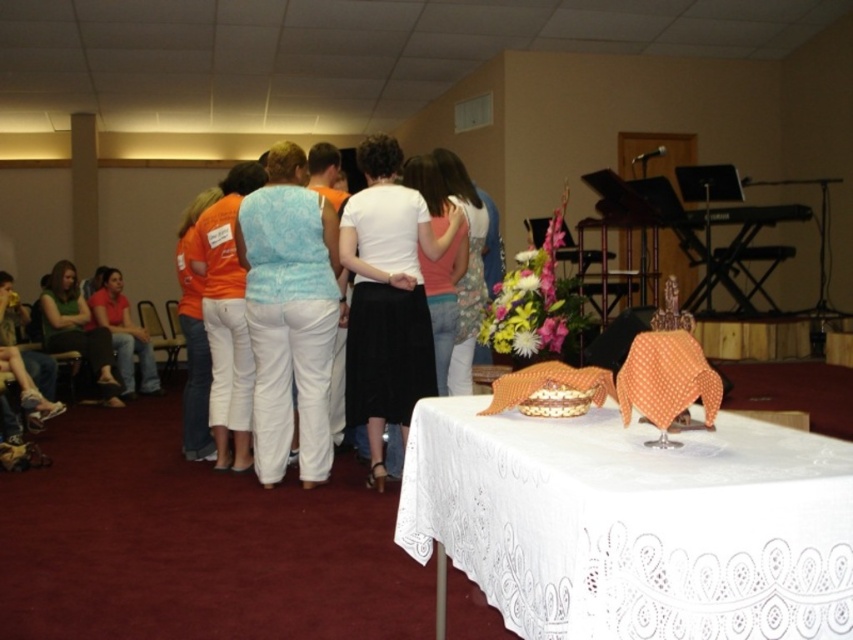
Who is positioned more to the left, orange cotton shirt at center or floral-patterned fabric at center?

Positioned to the left is orange cotton shirt at center.

Does orange cotton shirt at center lie behind floral-patterned fabric at center?

Yes, orange cotton shirt at center is further from the viewer.

Does point (181, 310) come closer to viewer compared to point (477, 282)?

That is False.

What are the coordinates of `orange cotton shirt at center` in the screenshot? It's located at (194, 337).

Who is lower down, white matte skirt at center or green fabric shirt at lower left?

green fabric shirt at lower left is lower down.

Can you confirm if white matte skirt at center is taller than green fabric shirt at lower left?

Yes, white matte skirt at center is taller than green fabric shirt at lower left.

Is point (439, 256) farther from viewer compared to point (70, 305)?

No, it is not.

The image size is (853, 640). In order to click on white matte skirt at center in this screenshot , I will do `click(387, 298)`.

Does orange cotton shirt at center have a smaller size compared to green fabric shirt at lower left?

Correct, orange cotton shirt at center occupies less space than green fabric shirt at lower left.

Can you confirm if orange cotton shirt at center is bigger than green fabric shirt at lower left?

No, orange cotton shirt at center is not bigger than green fabric shirt at lower left.

At what (x,y) coordinates should I click in order to perform the action: click on orange cotton shirt at center. Please return your answer as a coordinate pair (x, y). Looking at the image, I should click on (194, 337).